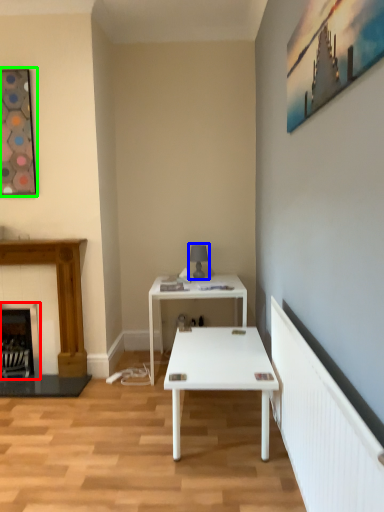
Question: Which object is the farthest from fireplace (highlighted by a red box)? Choose among these: table lamp (highlighted by a blue box) or picture frame (highlighted by a green box).

Choices:
 (A) table lamp
 (B) picture frame

Answer: (A)